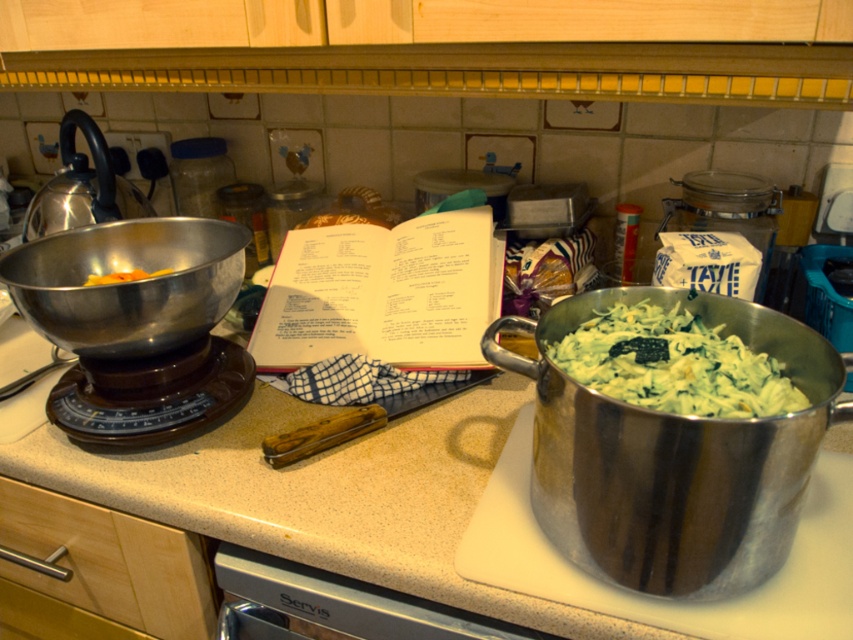
Is point (35, 461) positioned before point (722, 349)?

No, (35, 461) is further to viewer.

Does beige laminate countertop at center appear on the left side of green creamy salad at center?

Indeed, beige laminate countertop at center is positioned on the left side of green creamy salad at center.

At what (x,y) coordinates should I click in order to perform the action: click on beige laminate countertop at center. Please return your answer as a coordinate pair (x, y). This screenshot has width=853, height=640. Looking at the image, I should click on (329, 496).

Measure the distance between point [350,470] and camera.

28.48 inches

Between beige laminate countertop at center and metallic bowl at left, which one is positioned higher?

metallic bowl at left

Who is more distant from viewer, (444, 502) or (90, 323)?

Point (90, 323)

This screenshot has width=853, height=640. What are the coordinates of `beige laminate countertop at center` in the screenshot? It's located at (329, 496).

Does metallic bowl at left have a greater height compared to green creamy salad at center?

Indeed, metallic bowl at left has a greater height compared to green creamy salad at center.

Where is `metallic bowl at left`? metallic bowl at left is located at coordinates (126, 284).

Identify the location of metallic bowl at left. (126, 284).